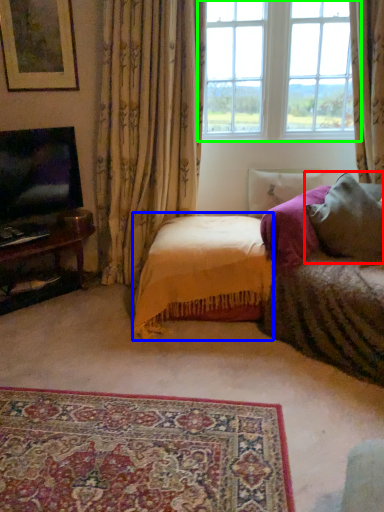
Question: Estimate the real-world distances between objects in this image. Which object is closer to pillow (highlighted by a red box), bedding (highlighted by a blue box) or window (highlighted by a green box)?

Choices:
 (A) bedding
 (B) window

Answer: (A)